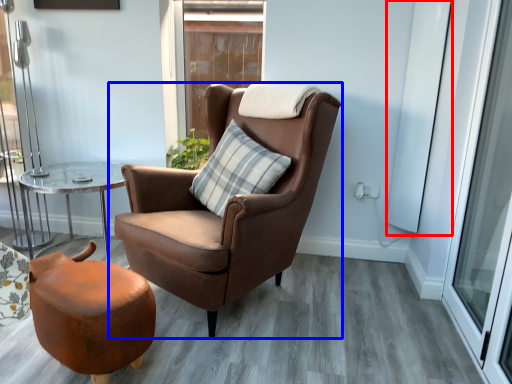
Question: Which object appears closest to the camera in this image, screen door (highlighted by a red box) or chair (highlighted by a blue box)?

Choices:
 (A) screen door
 (B) chair

Answer: (B)